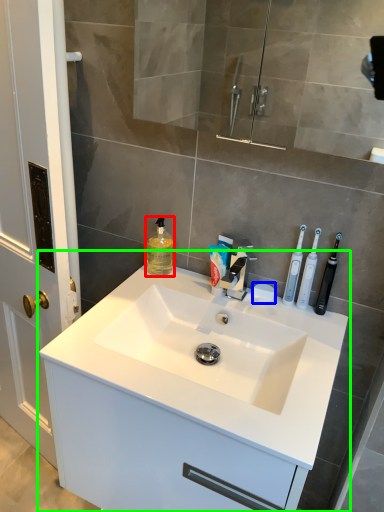
Question: Estimate the real-world distances between objects in this image. Which object is farther from mouthwash (highlighted by a red box), soap (highlighted by a blue box) or bathroom cabinet (highlighted by a green box)?

Choices:
 (A) soap
 (B) bathroom cabinet

Answer: (B)